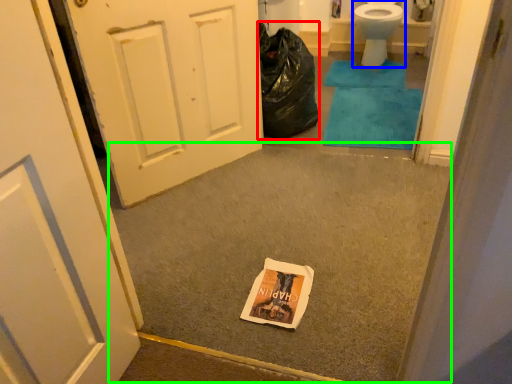
Question: Which is nearer to the garbage (highlighted by a red box)? toilet (highlighted by a blue box) or concrete (highlighted by a green box).

Choices:
 (A) toilet
 (B) concrete

Answer: (B)